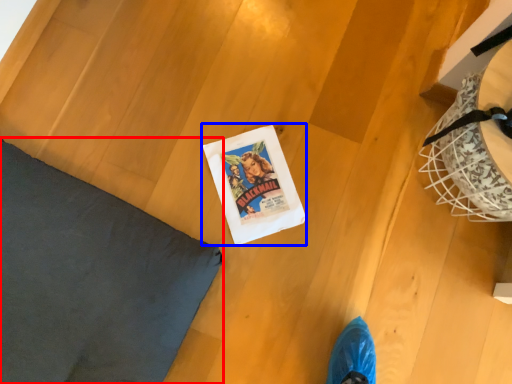
Question: Which object appears closest to the camera in this image, pillow (highlighted by a red box) or comic book (highlighted by a blue box)?

Choices:
 (A) pillow
 (B) comic book

Answer: (A)